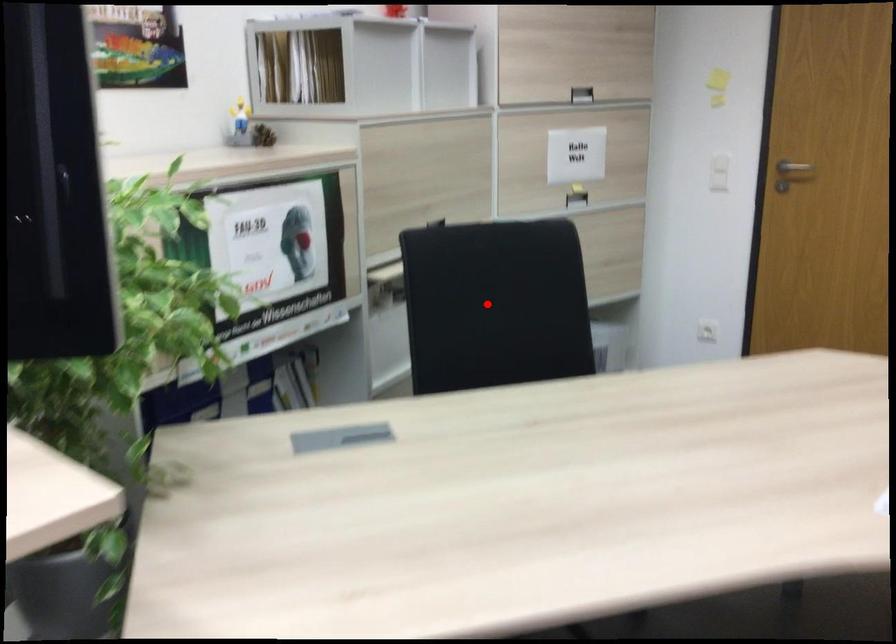
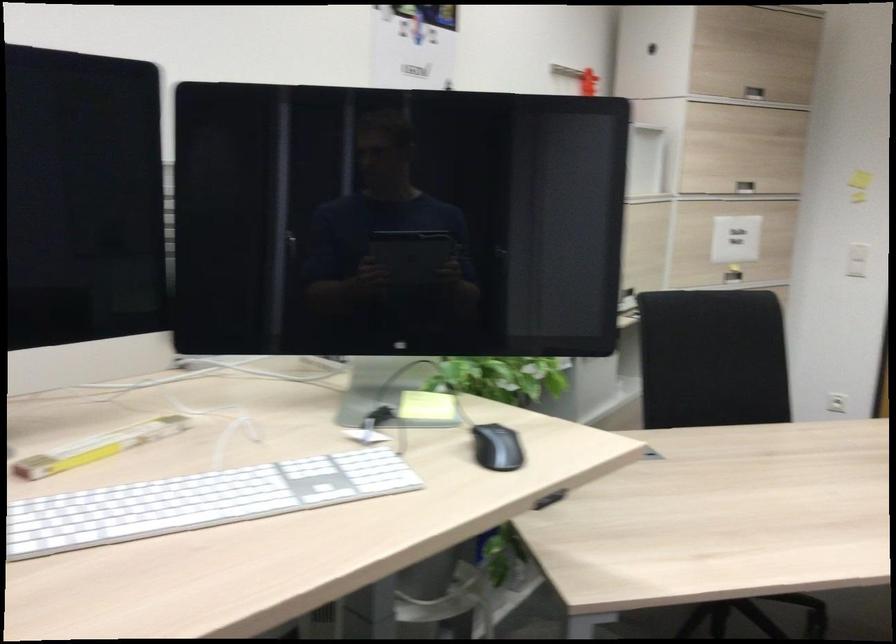
Find the pixel in the second image that matches the highlighted location in the first image.

(712, 359)